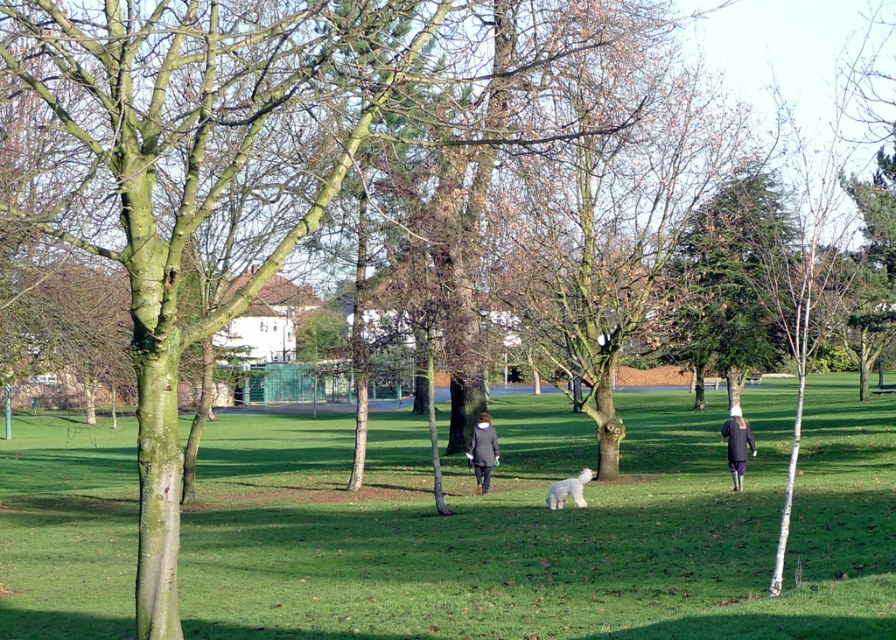
You are standing at the edge of the park and want to greet the person wearing the dark gray wool coat at center and the person in purple fabric pants at right. If you walk directly towards them, who will you reach first?

You will reach the dark gray wool coat at center first because it is closer to you than the purple fabric pants at right, which is farther away.